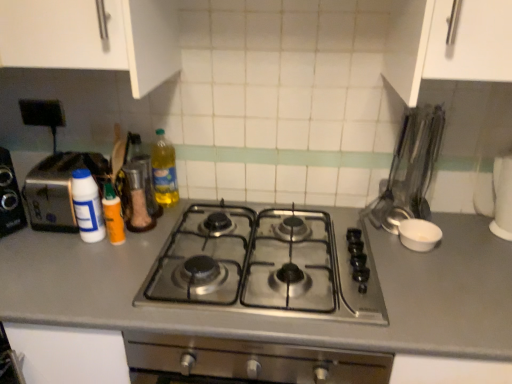
Image resolution: width=512 pixels, height=384 pixels. Identify the location of unoccupied region to the right of translucent orange bottle at center left, which is counted as the second bottle, starting from the right. (146, 238).